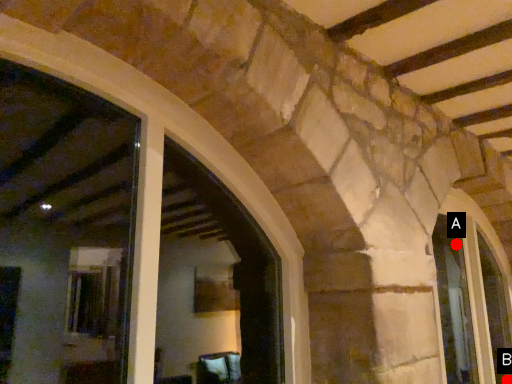
Question: Two points are circled on the image, labeled by A and B beside each circle. Which point appears farthest from the camera in this image?

Choices:
 (A) A is further
 (B) B is further

Answer: (A)